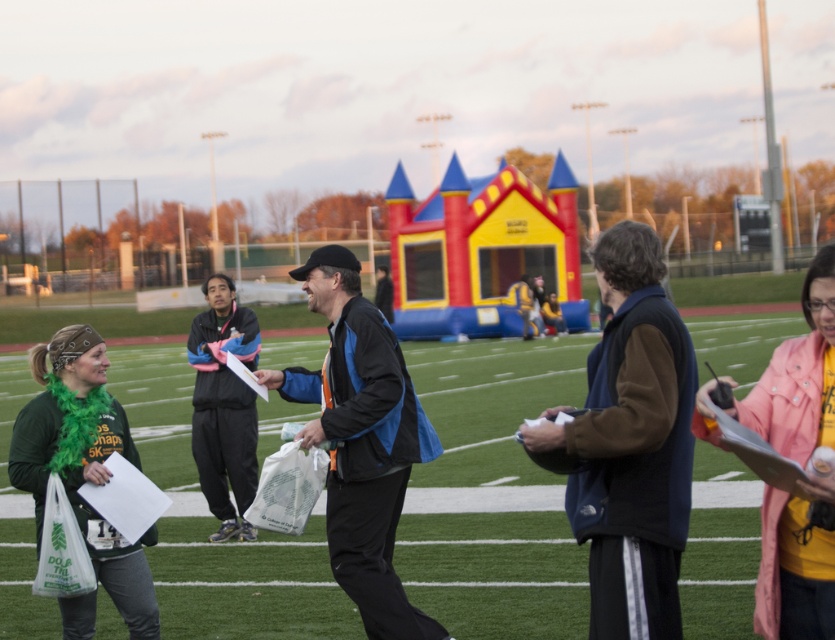
You are organizing a small picnic and need to decide where to place your blanket. The green artificial turf at center and the pink fabric jacket at lower right are both visible in the image. Which area would provide more space for your picnic blanket?

The green artificial turf at center is bigger than the pink fabric jacket at lower right, so it would provide more space for your picnic blanket.